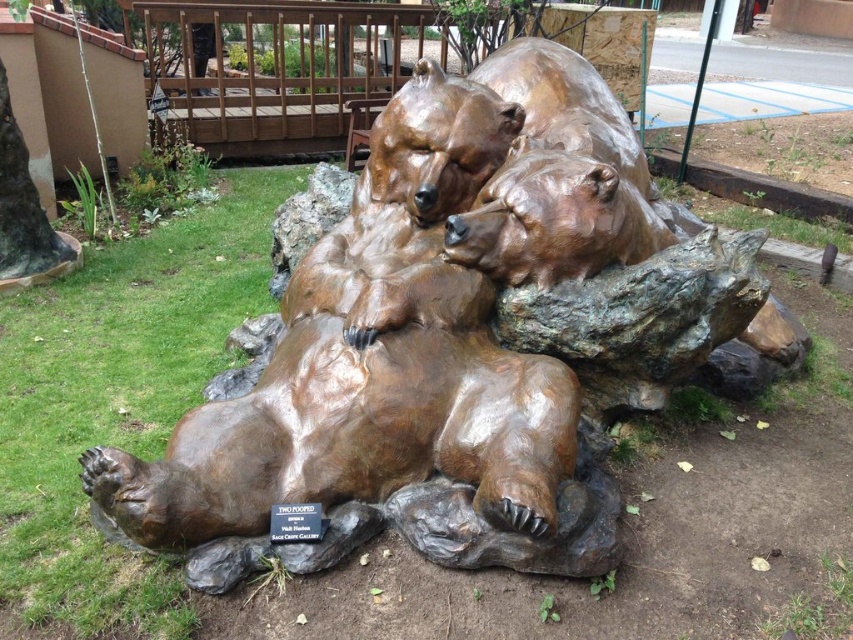
Question: Among these points, which one is farthest from the camera?

Choices:
 (A) (560, 221)
 (B) (569, 502)

Answer: (A)

Question: Does bronze bear sculpture at center have a greater width compared to bronze bear at center?

Choices:
 (A) yes
 (B) no

Answer: (A)

Question: Observing the image, what is the correct spatial positioning of bronze bear sculpture at center in reference to bronze bear at center?

Choices:
 (A) right
 (B) left

Answer: (B)

Question: Which point appears closest to the camera in this image?

Choices:
 (A) (548, 192)
 (B) (343, 429)

Answer: (B)

Question: Can you confirm if bronze bear sculpture at center is positioned to the right of bronze bear at center?

Choices:
 (A) yes
 (B) no

Answer: (B)